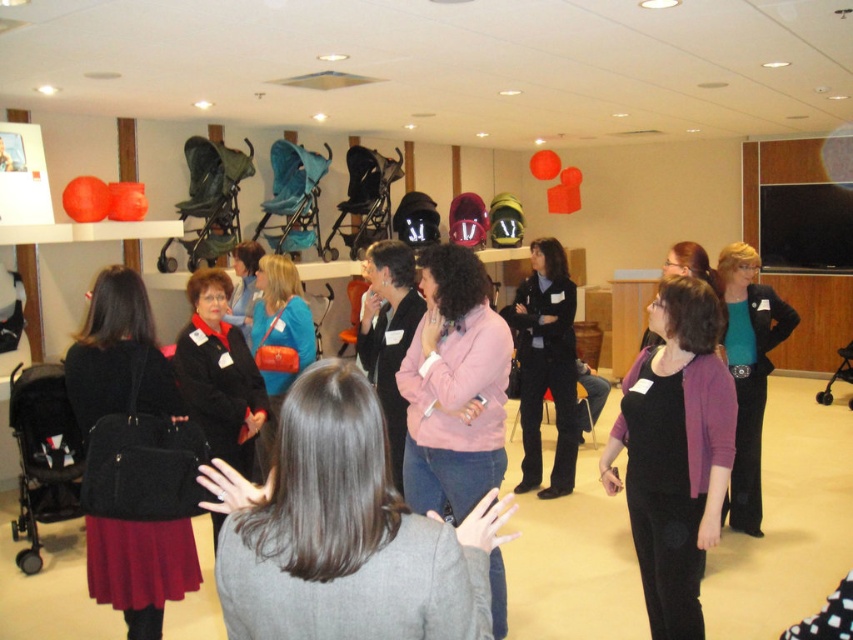
You are a person holding a package that is 3.5 feet long. You want to place it on the floor in front of the gray wool coat at center without touching the coat. Is there enough space between you and the coat to do this?

The distance between you and the gray wool coat at center is 3.85 feet. Since the package is 3.5 feet long, there is enough space to place it on the floor in front of the coat without touching it.

You are standing at the entrance of the room and want to find the pink matte sweater at center. According to the coordinates given, in which direction should you move relative to your current position?

The pink matte sweater at center is located at coordinates point (454, 387). Since the coordinate system is not specified, it is difficult to determine the exact direction to move. However, in many standard coordinate systems, the x and y values increase from the bottom left corner. Assuming this is the case, the sweater is positioned to the right and slightly above the center point of the room. Therefore, you should move towards the right and slightly forward from your current position at the entrance to